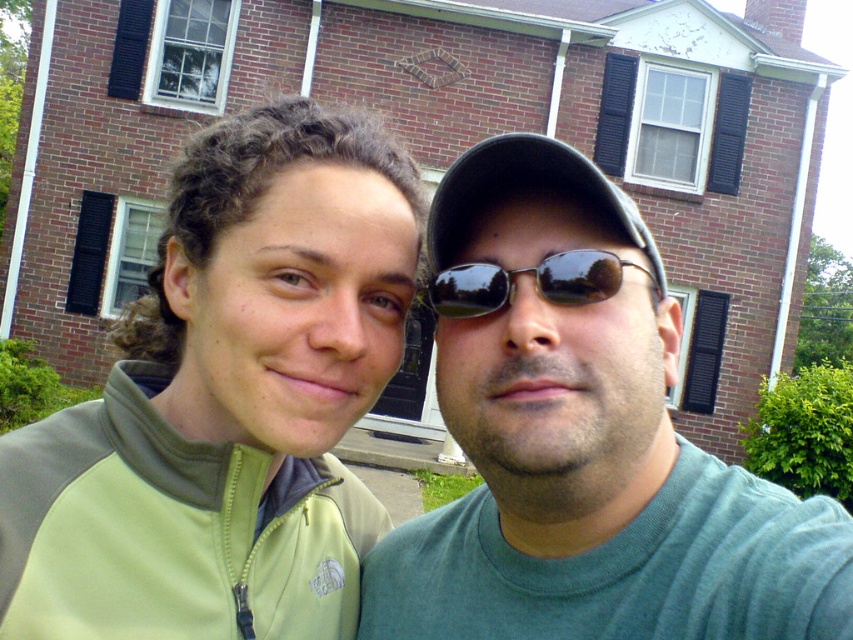
You are a photographer trying to capture a group photo of two people wearing green jackets. You need to ensure there is enough space between them for a natural pose. If the minimum required distance for a comfortable pose is 12 inches, can the two people wearing the green fleece jacket at center and the green matte shirt at center maintain this distance?

The distance between the green fleece jacket at center and the green matte shirt at center is 12.30 inches, which exceeds the minimum required 12 inches. Therefore, they can comfortably maintain the distance for a natural pose.

You are a photographer trying to frame a closeup shot of the two people in the image. You want to ensure both the black matte baseball cap at center and the black reflective sunglasses at center are fully visible in the frame. Given their positions, which object might require more space horizontally in the frame?

The black matte baseball cap at center might be wider than the black reflective sunglasses at center, so it might require more horizontal space in the frame to ensure it is fully visible.

You are a photographer trying to capture a photo of both the green fleece jacket at center and the green matte shirt at center. Since you want to ensure both are fully visible, which one should you focus on first to avoid cropping the top of the image?

The green fleece jacket at center is taller than the green matte shirt at center, so you should focus on ensuring the green fleece jacket at center is fully visible first to avoid cropping the top of the image.